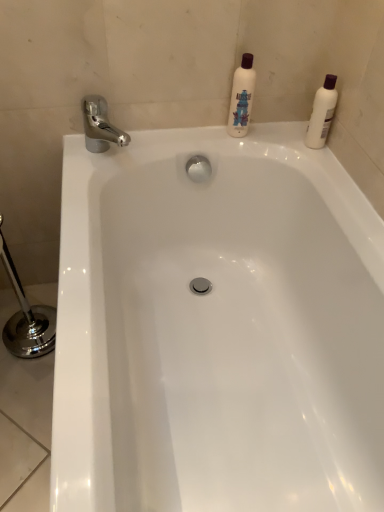
The width and height of the screenshot is (384, 512). What are the coordinates of `spots to the right of white matte bottle at upper center, which is the 2th cleaning product in right-to-left order` in the screenshot? It's located at (289, 140).